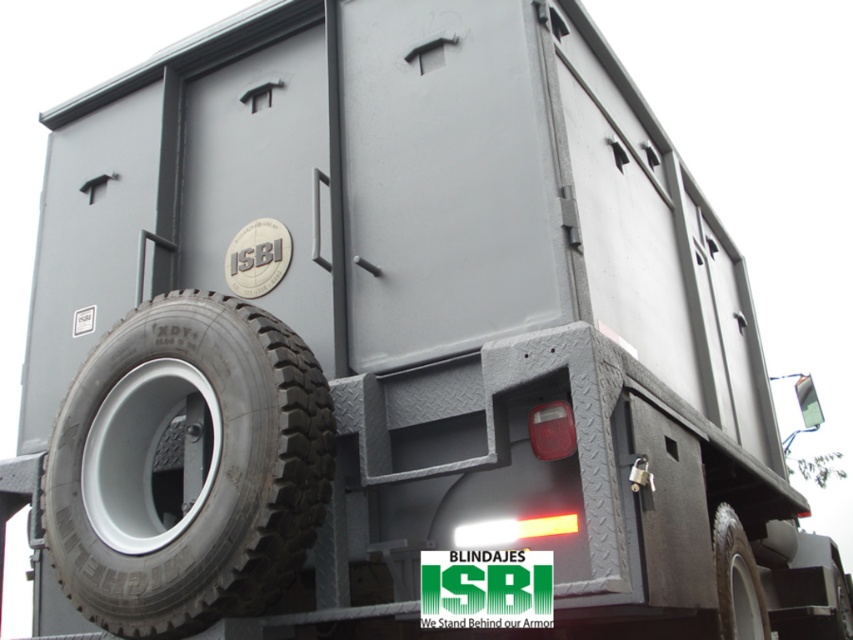
You are a mechanic working on the armored vehicle. You need to locate the black rubber tire at lower left. Where exactly is it positioned?

The black rubber tire at lower left is positioned at point (187, 467).

You are a delivery driver who needs to check the tire pressure of the black rubber tire at lower left located at point (187, 467). Can you confirm if this tire is positioned on the left or right side of the vehicle?

The black rubber tire at lower left is located at point (187, 467), which is on the left side of the vehicle.

You are a technician measuring the distance between the two tires for maintenance purposes. Given that the minimum required distance for proper maintenance equipment access is 2 meters, can you confirm if the space between the black rubber tire at lower left and the black rubber tire at lower right is sufficient?

The distance between the black rubber tire at lower left and the black rubber tire at lower right is 2.03 meters, which exceeds the minimum required 2 meters. Therefore, the space is sufficient for proper maintenance equipment access.